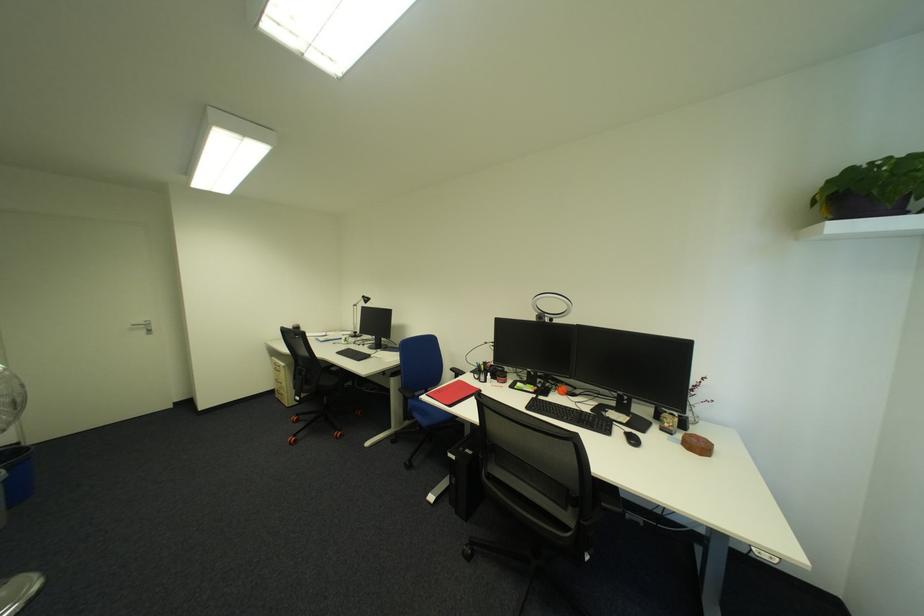
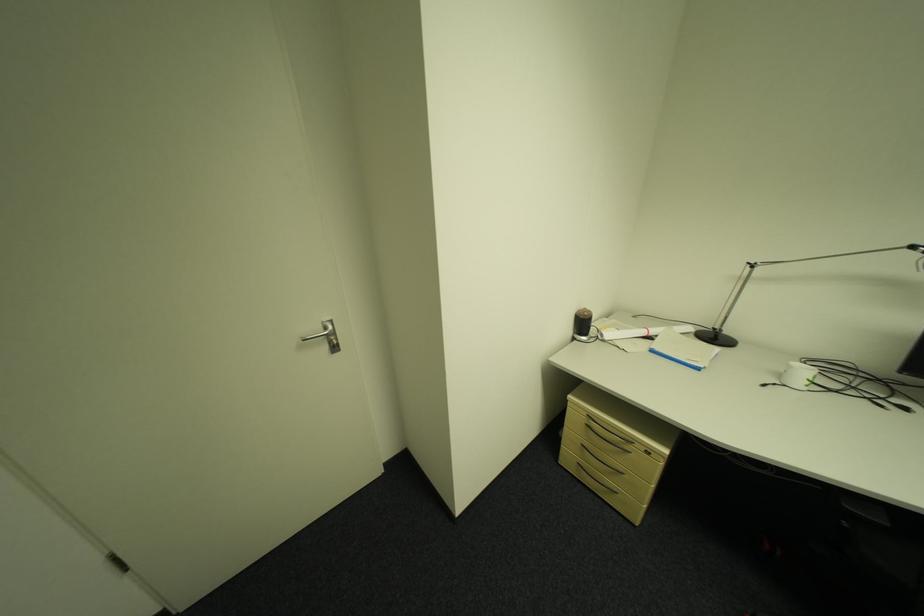
Where in the second image is the point corresponding to point (154, 333) from the first image?

(335, 349)